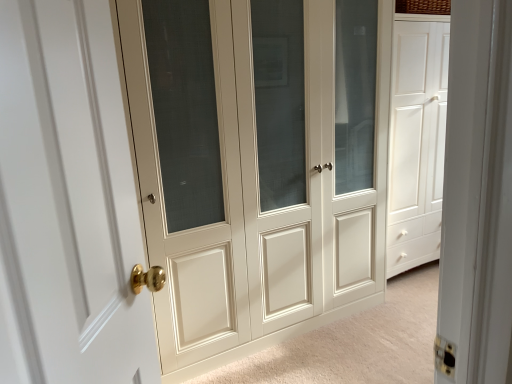
Question: Would you say matte cream cabinet at center, the second door when ordered from left to right, is to the left or to the right of white glossy door at left, the 2th door viewed from the back, in the picture?

Choices:
 (A) left
 (B) right

Answer: (B)

Question: From the image's perspective, relative to white glossy door at left, which ranks as the 1th door in left-to-right order, is matte cream cabinet at center, which is the 1th door in right-to-left order, above or below?

Choices:
 (A) below
 (B) above

Answer: (B)

Question: Looking at the image, does matte cream cabinet at center, the second door when ordered from left to right, seem bigger or smaller compared to white glossy door at left, acting as the second door starting from the right?

Choices:
 (A) small
 (B) big

Answer: (B)

Question: Based on their sizes in the image, would you say white glossy door at left, which ranks as the 1th door in left-to-right order, is bigger or smaller than matte cream cabinet at center, which is the first door from back to front?

Choices:
 (A) big
 (B) small

Answer: (B)

Question: Is point (35, 274) positioned closer to the camera than point (139, 157)?

Choices:
 (A) farther
 (B) closer

Answer: (B)

Question: From the image's perspective, relative to matte cream cabinet at center, the second door when ordered from left to right, is white glossy door at left, acting as the second door starting from the right, above or below?

Choices:
 (A) above
 (B) below

Answer: (B)

Question: Is white glossy door at left, the 2th door viewed from the back, spatially inside matte cream cabinet at center, which is the second door from front to back, or outside of it?

Choices:
 (A) inside
 (B) outside

Answer: (B)